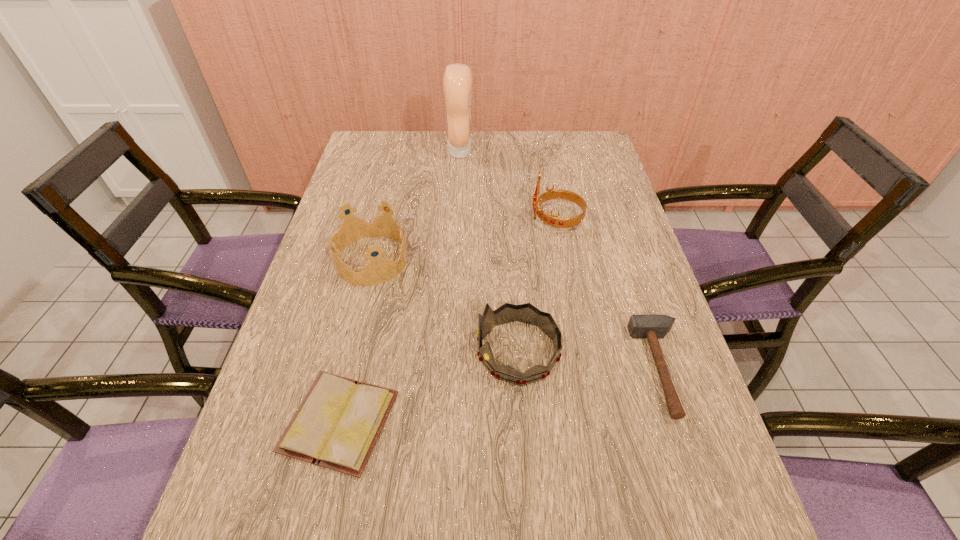
Point out which object is positioned as the second nearest to the shortest object. Please provide its 2D coordinates. Your answer should be formatted as a tuple, i.e. [(x, y)], where the tuple contains the x and y coordinates of a point satisfying the conditions above.

[(379, 270)]

Where is `object that is the fourth closest to the leftmost tiara`? object that is the fourth closest to the leftmost tiara is located at coordinates (457, 80).

Choose which tiara is the nearest neighbor to the second farthest object. Please provide its 2D coordinates. Your answer should be formatted as a tuple, i.e. [(x, y)], where the tuple contains the x and y coordinates of a point satisfying the conditions above.

[(526, 313)]

Locate an element on the screen. The image size is (960, 540). tiara identified as the closest to the diary is located at coordinates (526, 313).

You are a GUI agent. You are given a task and a screenshot of the screen. Output one action in this format:
    pyautogui.click(x=<x>, y=<y>)
    Task: Click on the vacant area in the image that satisfies the following two spatial constraints: 1. on the striking surface of the hammer; 2. on the front side of the shortest object
    The image size is (960, 540).
    Given the screenshot: What is the action you would take?
    pyautogui.click(x=680, y=421)

Identify the location of vacant space that satisfies the following two spatial constraints: 1. on the front-facing side of the third farthest object; 2. on the left side of the diary. (331, 421).

Locate an element on the screen. The image size is (960, 540). vacant space that satisfies the following two spatial constraints: 1. on the front-facing side of the leftmost tiara; 2. on the left side of the shortest object is located at coordinates (331, 421).